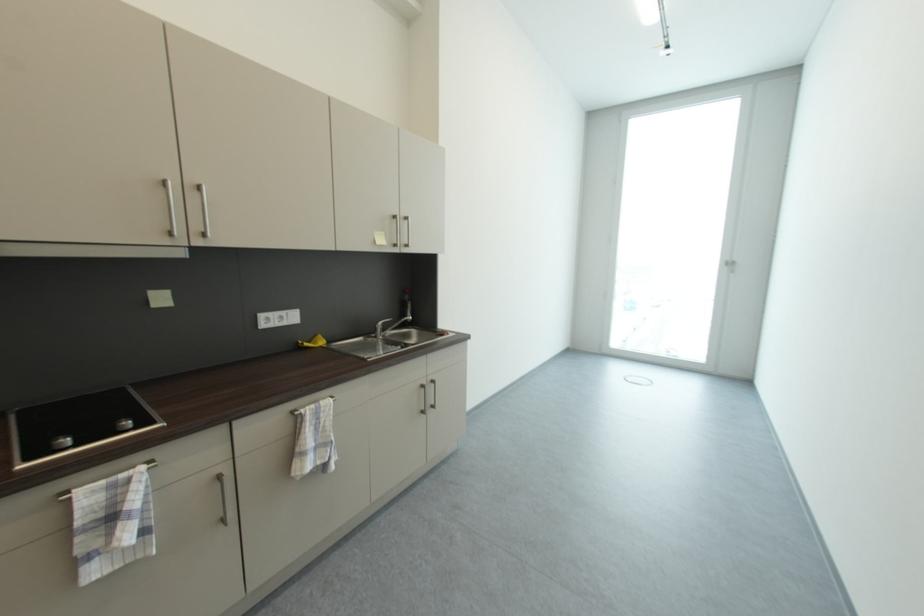
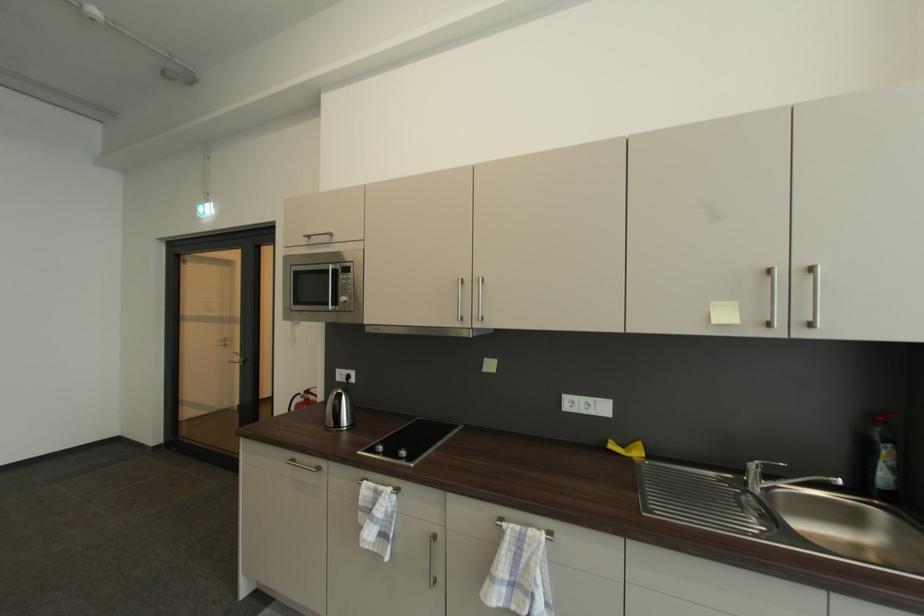
Question: The camera is either moving clockwise (left) or counter-clockwise (right) around the object. The first image is from the beginning of the video and the second image is from the end. Is the camera moving left or right when shooting the video?

Choices:
 (A) Left
 (B) Right

Answer: (B)